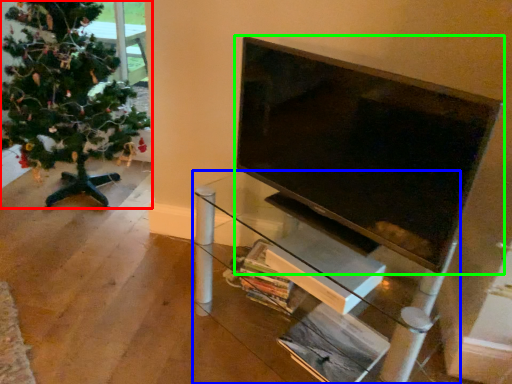
Question: Considering the real-world distances, which object is closest to christmas tree (highlighted by a red box)? furniture (highlighted by a blue box) or television (highlighted by a green box).

Choices:
 (A) furniture
 (B) television

Answer: (A)